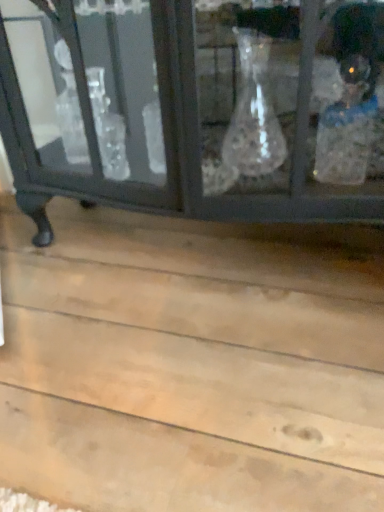
Identify the location of blank space situated above natural wood plank at lower center (from a real-world perspective). The width and height of the screenshot is (384, 512). (148, 302).